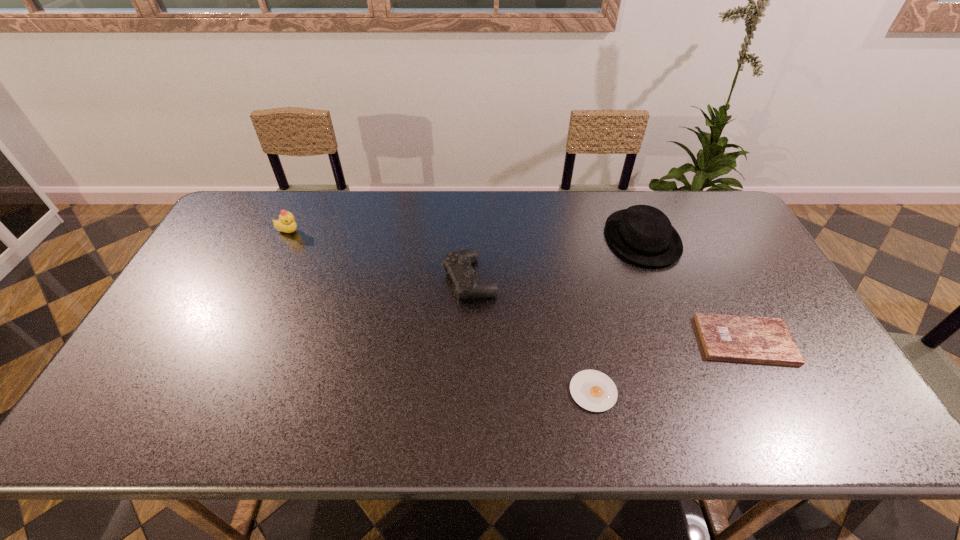
Locate an element on the screen. free space in the image that satisfies the following two spatial constraints: 1. on the front-facing side of the leftmost object; 2. on the back side of the fedora is located at coordinates (285, 238).

At what (x,y) coordinates should I click in order to perform the action: click on vacant area in the image that satisfies the following two spatial constraints: 1. on the back side of the control; 2. on the front-facing side of the leftmost object. Please return your answer as a coordinate pair (x, y). Looking at the image, I should click on (471, 232).

Locate an element on the screen. vacant position in the image that satisfies the following two spatial constraints: 1. on the back side of the shortest object; 2. on the front-facing side of the duckling is located at coordinates (562, 232).

Find the location of a particular element. free spot that satisfies the following two spatial constraints: 1. on the back side of the fedora; 2. on the left side of the fourth object from right to left is located at coordinates 471,238.